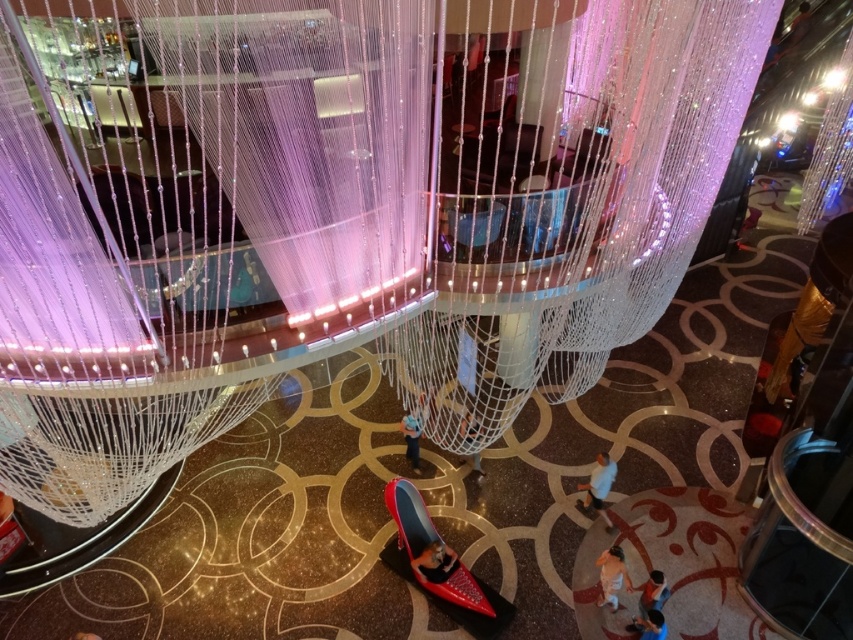
Question: Can you confirm if blue matte shirt at lower right is positioned above light blue fabric shirt at lower right?

Choices:
 (A) no
 (B) yes

Answer: (B)

Question: Is blue denim jeans at center wider than light blue fabric shirt at lower right?

Choices:
 (A) yes
 (B) no

Answer: (A)

Question: Which point is farther to the camera?

Choices:
 (A) (444, 552)
 (B) (637, 627)
 (C) (469, 465)

Answer: (C)

Question: Is matte black shoe at lower center smaller than light blue fabric shirt at lower right?

Choices:
 (A) no
 (B) yes

Answer: (B)

Question: Which is farther from the light blue fabric shirt at lower right?

Choices:
 (A) matte black shoe at center
 (B) blue matte shirt at lower right
 (C) blue denim jeans at center

Answer: (C)

Question: Which of these objects is positioned closest to the blue matte shirt at lower right?

Choices:
 (A) blue fabric person at lower right
 (B) orange fabric person at lower right
 (C) matte black shoe at center

Answer: (B)